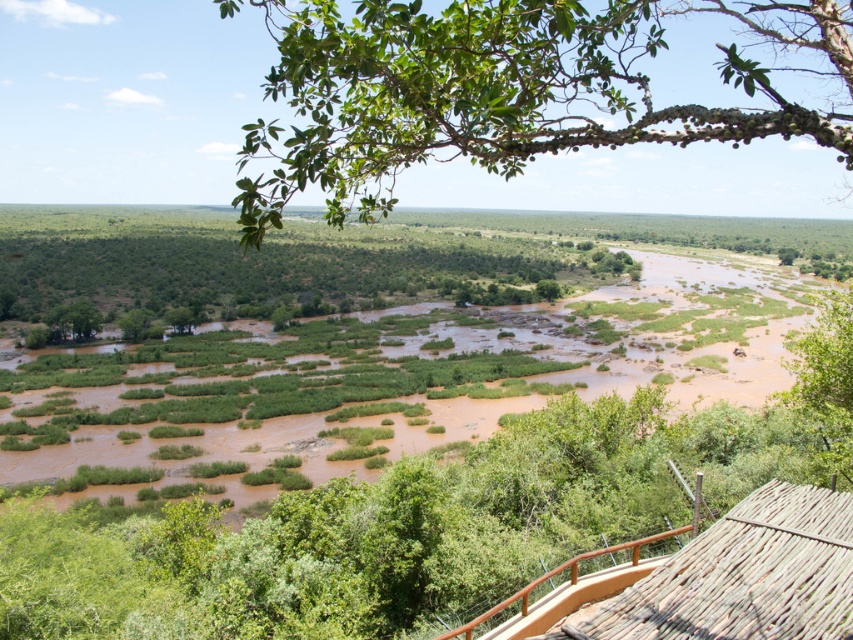
Question: Can you confirm if green leafy branch at upper center is positioned to the right of brown wood railing at lower right?

Choices:
 (A) yes
 (B) no

Answer: (A)

Question: Considering the real-world distances, which object is closest to the green leafy branch at upper center?

Choices:
 (A) green leafy tree at lower left
 (B) brown wood railing at lower right

Answer: (A)

Question: Which of the following is the closest to the observer?

Choices:
 (A) (639, 612)
 (B) (463, 632)
 (C) (558, 125)

Answer: (C)

Question: Is thatched wood hut at lower right wider than green leafy tree at lower left?

Choices:
 (A) no
 (B) yes

Answer: (A)

Question: Which object is the farthest from the green leafy tree at lower left?

Choices:
 (A) thatched wood hut at lower right
 (B) brown wood railing at lower right
 (C) green leafy branch at upper center

Answer: (C)

Question: Can you confirm if thatched wood hut at lower right is positioned above brown wood railing at lower right?

Choices:
 (A) no
 (B) yes

Answer: (B)